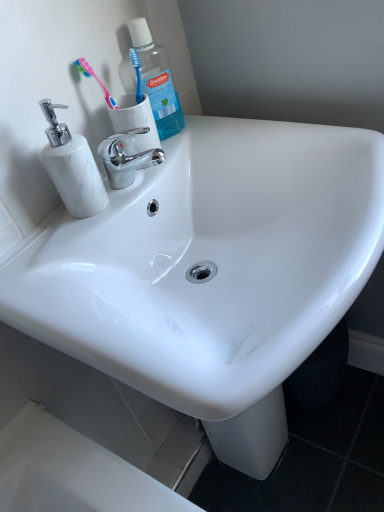
Question: Is white marble soap dispenser at left smaller than chrome/metallic faucet at center?

Choices:
 (A) no
 (B) yes

Answer: (A)

Question: Is white marble soap dispenser at left facing towards chrome/metallic faucet at center?

Choices:
 (A) no
 (B) yes

Answer: (A)

Question: Is white marble soap dispenser at left wider than chrome/metallic faucet at center?

Choices:
 (A) yes
 (B) no

Answer: (B)

Question: Is white marble soap dispenser at left looking in the opposite direction of chrome/metallic faucet at center?

Choices:
 (A) yes
 (B) no

Answer: (B)

Question: Is white marble soap dispenser at left at the right side of chrome/metallic faucet at center?

Choices:
 (A) no
 (B) yes

Answer: (A)

Question: Is white marble soap dispenser at left closer to camera compared to chrome/metallic faucet at center?

Choices:
 (A) yes
 (B) no

Answer: (A)

Question: Is white glossy sink at center located outside white marble soap dispenser at left?

Choices:
 (A) yes
 (B) no

Answer: (A)

Question: Is white glossy sink at center to the right of white marble soap dispenser at left from the viewer's perspective?

Choices:
 (A) yes
 (B) no

Answer: (A)

Question: Is white glossy sink at center aimed at white marble soap dispenser at left?

Choices:
 (A) yes
 (B) no

Answer: (B)

Question: Can you confirm if white glossy sink at center is positioned to the left of white marble soap dispenser at left?

Choices:
 (A) yes
 (B) no

Answer: (B)

Question: Is white glossy sink at center oriented away from white marble soap dispenser at left?

Choices:
 (A) no
 (B) yes

Answer: (A)

Question: Does white glossy sink at center lie behind white marble soap dispenser at left?

Choices:
 (A) no
 (B) yes

Answer: (A)

Question: Considering the relative sizes of blue translucent plastic mouthwash at upper left and pink plastic toothbrush at upper left in the image provided, is blue translucent plastic mouthwash at upper left bigger than pink plastic toothbrush at upper left?

Choices:
 (A) yes
 (B) no

Answer: (A)